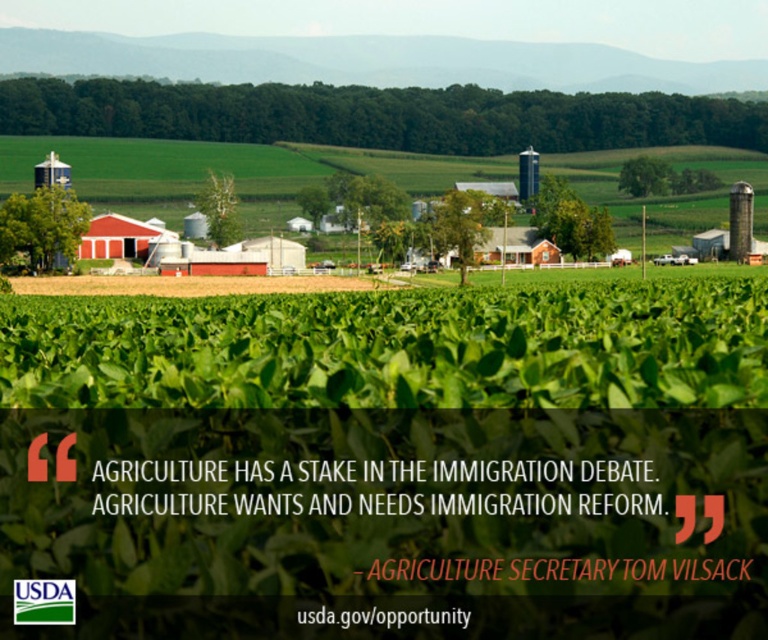
Describe the element at coordinates (121, 237) in the screenshot. I see `matte red barn at center-left` at that location.

Which is below, matte red barn at center-left or matte red barn at center?

matte red barn at center is below.

This screenshot has width=768, height=640. What do you see at coordinates (121, 237) in the screenshot?
I see `matte red barn at center-left` at bounding box center [121, 237].

Where is `matte red barn at center-left`? Image resolution: width=768 pixels, height=640 pixels. matte red barn at center-left is located at coordinates (121, 237).

The height and width of the screenshot is (640, 768). In order to click on gray concrete silo at right in this screenshot , I will do `click(740, 220)`.

Can you confirm if gray concrete silo at right is wider than red corrugated metal barn at center?

In fact, gray concrete silo at right might be narrower than red corrugated metal barn at center.

Who is more distant from viewer, (750, 221) or (290, 269)?

Positioned behind is point (750, 221).

Identify the location of gray concrete silo at right. The height and width of the screenshot is (640, 768). (740, 220).

Which of these two, matte red barn at center-left or gray concrete silo at right, stands taller?

With more height is gray concrete silo at right.

Does matte red barn at center-left have a lesser width compared to gray concrete silo at right?

Incorrect, matte red barn at center-left's width is not less than gray concrete silo at right's.

This screenshot has height=640, width=768. What are the coordinates of `matte red barn at center-left` in the screenshot? It's located at (121, 237).